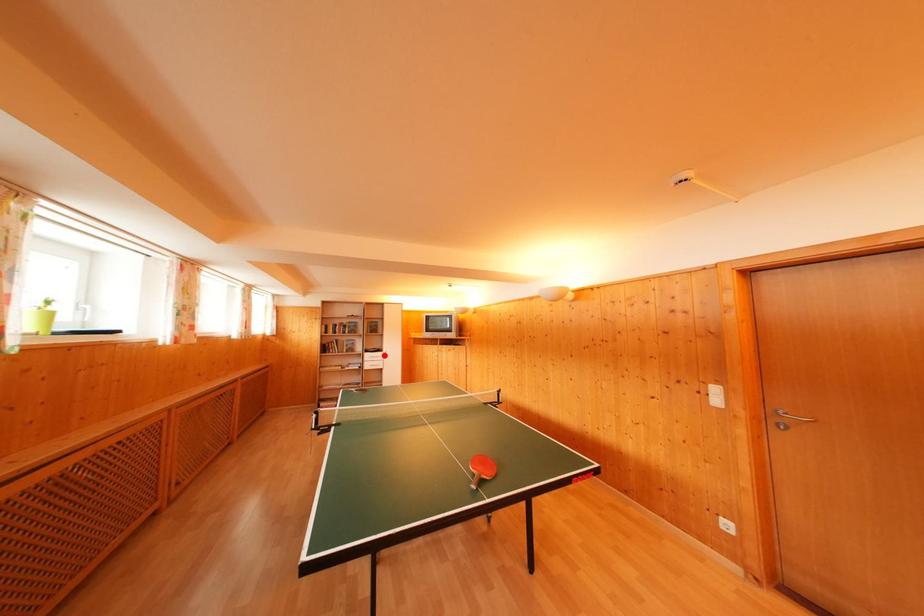
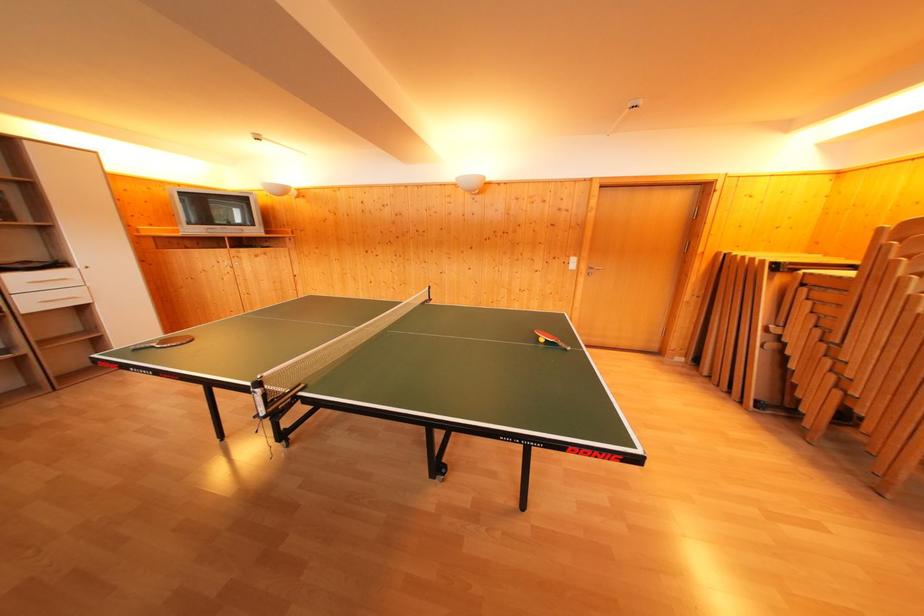
The point at the highlighted location is marked in the first image. Where is the corresponding point in the second image?

(64, 270)